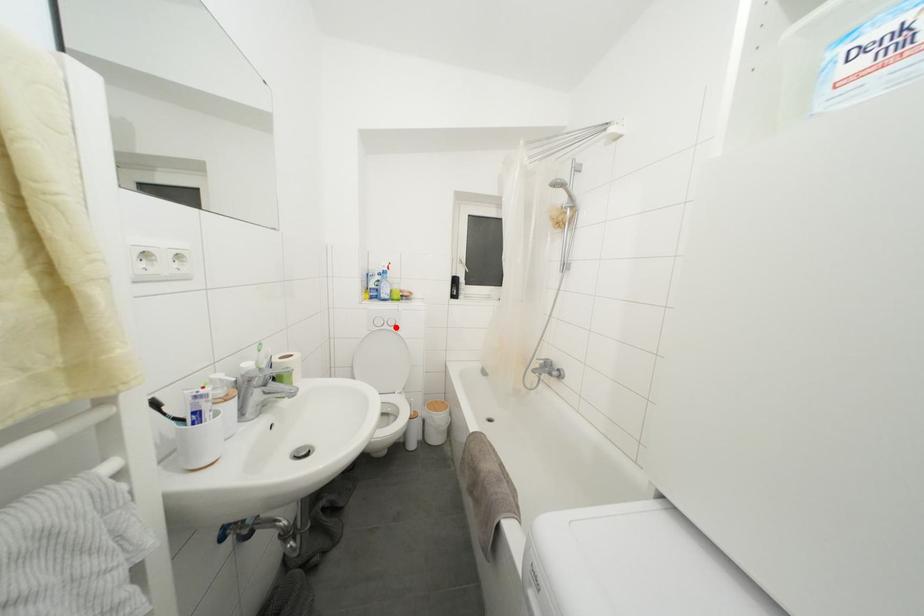
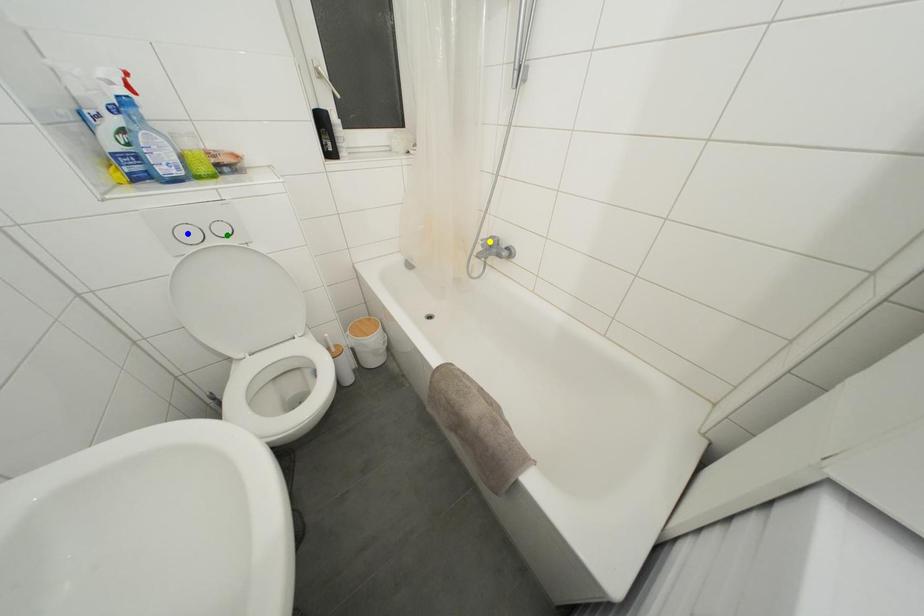
Question: I am providing you with two images of the same scene from different viewpoints. A red point is marked on the first image. You are given multiple points on the second image. Which spot in image 2 lines up with the point in image 1?

Choices:
 (A) green point
 (B) blue point
 (C) yellow point

Answer: (A)